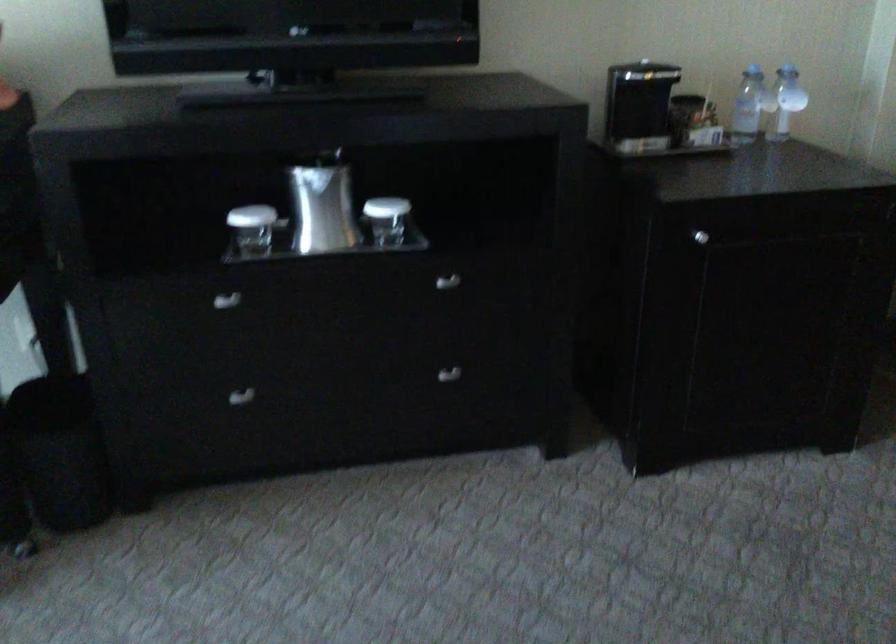
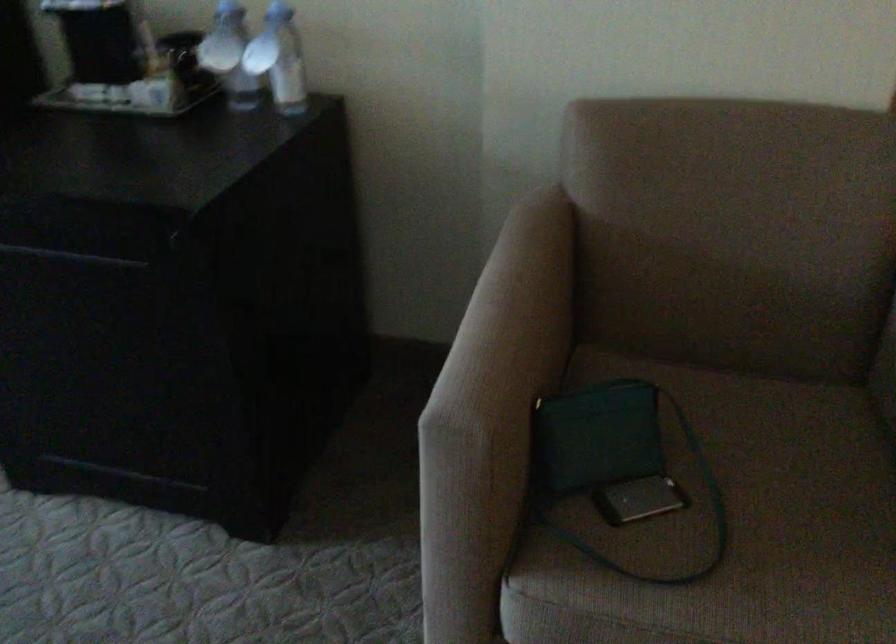
Locate, in the second image, the point that corresponds to the point at 765,91 in the first image.

(229, 55)